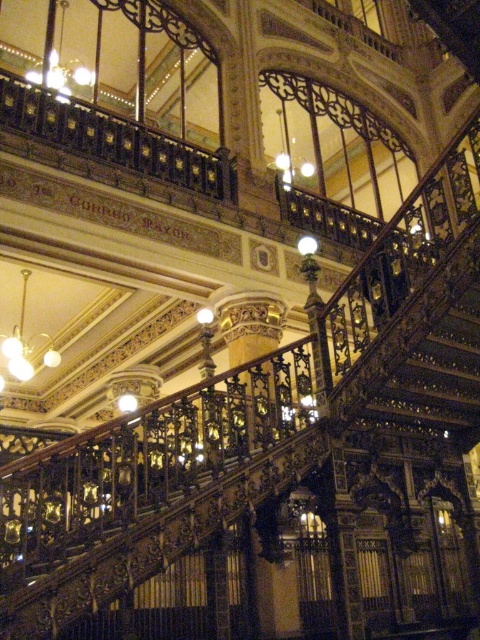
You are standing at the base of the ornate staircase and looking up. There is a point marked at coordinates (60,58). What object is located at this point?

The point at coordinates (60,58) marks the location of the metallic chandelier at upper left.

In the scene shown: You are standing at the bottom of the staircase and notice two chandeliers above you. Which one is positioned to the right when looking up at the metallic chandelier at upper left and matte gold chandelier at upper left?

The metallic chandelier at upper left is positioned to the right of the matte gold chandelier at upper left.